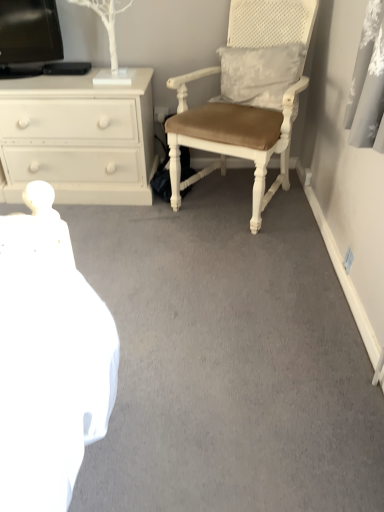
Question: Based on their positions, is white wood chair at right located to the left or right of white painted wood chest of drawers at left?

Choices:
 (A) right
 (B) left

Answer: (A)

Question: Is white wood chair at right bigger or smaller than white painted wood chest of drawers at left?

Choices:
 (A) big
 (B) small

Answer: (A)

Question: Looking at their shapes, would you say white wood chair at right is wider or thinner than white painted wood chest of drawers at left?

Choices:
 (A) wide
 (B) thin

Answer: (A)

Question: From their relative heights in the image, would you say white painted wood chest of drawers at left is taller or shorter than white wood chair at right?

Choices:
 (A) short
 (B) tall

Answer: (A)

Question: Considering the positions of white painted wood chest of drawers at left and white wood chair at right in the image, is white painted wood chest of drawers at left bigger or smaller than white wood chair at right?

Choices:
 (A) small
 (B) big

Answer: (A)

Question: Is white painted wood chest of drawers at left inside or outside of white wood chair at right?

Choices:
 (A) outside
 (B) inside

Answer: (A)

Question: Considering the positions of point (19, 132) and point (254, 207), is point (19, 132) closer or farther from the camera than point (254, 207)?

Choices:
 (A) closer
 (B) farther

Answer: (B)